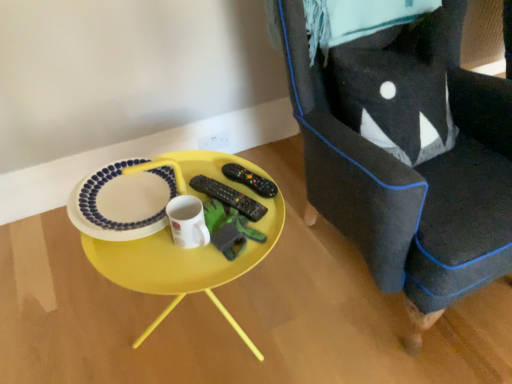
Question: Considering the relative sizes of black plastic remote control at center, the 2th remote control in the left-to-right sequence, and velvet dark blue armchair at right in the image provided, is black plastic remote control at center, the 2th remote control in the left-to-right sequence, wider than velvet dark blue armchair at right?

Choices:
 (A) yes
 (B) no

Answer: (B)

Question: From a real-world perspective, is black plastic remote control at center, the 2th remote control in the left-to-right sequence, positioned under velvet dark blue armchair at right based on gravity?

Choices:
 (A) yes
 (B) no

Answer: (A)

Question: Does black plastic remote control at center, the 2th remote control in the left-to-right sequence, have a larger size compared to velvet dark blue armchair at right?

Choices:
 (A) no
 (B) yes

Answer: (A)

Question: Can you confirm if black plastic remote control at center, the 2th remote control in the left-to-right sequence, is shorter than velvet dark blue armchair at right?

Choices:
 (A) no
 (B) yes

Answer: (B)

Question: Can you confirm if black plastic remote control at center, the 2th remote control in the left-to-right sequence, is thinner than velvet dark blue armchair at right?

Choices:
 (A) yes
 (B) no

Answer: (A)

Question: From a real-world perspective, does black plastic remote control at center, the first remote control positioned from the right, stand above velvet dark blue armchair at right?

Choices:
 (A) no
 (B) yes

Answer: (A)

Question: From the image's perspective, is green felt toy at center beneath yellow plastic table at center?

Choices:
 (A) no
 (B) yes

Answer: (A)

Question: From the image's perspective, would you say green felt toy at center is positioned over yellow plastic table at center?

Choices:
 (A) no
 (B) yes

Answer: (B)

Question: Considering the relative sizes of green felt toy at center and yellow plastic table at center in the image provided, is green felt toy at center thinner than yellow plastic table at center?

Choices:
 (A) no
 (B) yes

Answer: (B)

Question: Can you confirm if green felt toy at center is taller than yellow plastic table at center?

Choices:
 (A) yes
 (B) no

Answer: (B)

Question: Is green felt toy at center not inside yellow plastic table at center?

Choices:
 (A) yes
 (B) no

Answer: (B)

Question: Does green felt toy at center have a smaller size compared to yellow plastic table at center?

Choices:
 (A) yes
 (B) no

Answer: (A)

Question: Is black matte remote control at center, the 1th remote control from the left, oriented towards white glossy platter at center?

Choices:
 (A) no
 (B) yes

Answer: (A)